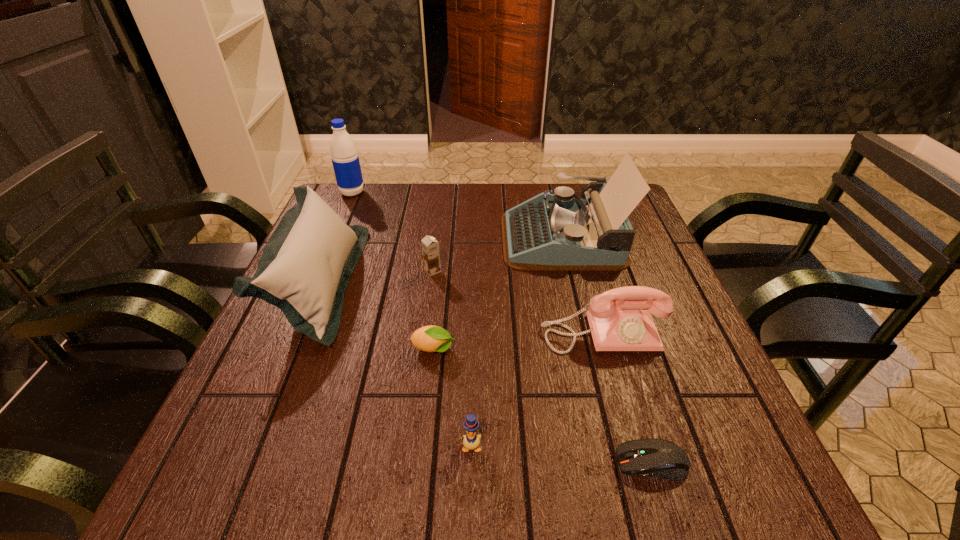
Where is `free space located 0.240m on the typing side of the typewriter`? Image resolution: width=960 pixels, height=540 pixels. free space located 0.240m on the typing side of the typewriter is located at coordinates (415, 238).

In order to click on vacant area located 0.160m on the typing side of the typewriter in this screenshot , I will do `click(444, 238)`.

The image size is (960, 540). I want to click on vacant space located 0.140m on the typing side of the typewriter, so click(x=451, y=238).

Identify the location of vacant space situated 0.130m on the surface of the cushion. The height and width of the screenshot is (540, 960). tap(408, 282).

This screenshot has width=960, height=540. Identify the location of vacant space positioned on the dial of the telephone. (623, 411).

This screenshot has height=540, width=960. Identify the location of free space located 0.160m on the back of the chocolate milk. (438, 229).

Locate an element on the screen. free spot located 0.060m on the face of the sixth tallest object, where the monocle is placed is located at coordinates (469, 492).

I want to click on vacant space located with leaves positioned above the lemon, so click(596, 349).

What are the coordinates of `free region located 0.360m on the button of the shortest object` in the screenshot? It's located at (398, 462).

Locate an element on the screen. This screenshot has width=960, height=540. vacant space situated 0.290m on the button of the shortest object is located at coordinates (x=441, y=462).